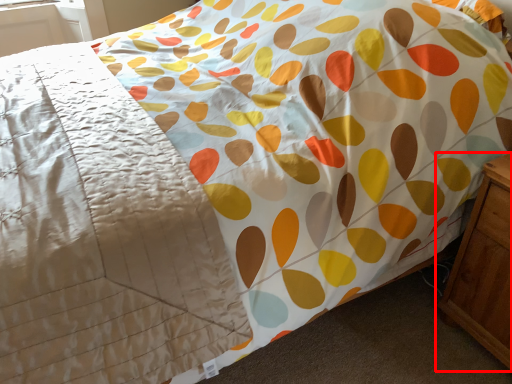
Question: From the image's perspective, considering the relative positions of nightstand (annotated by the red box) and blanket in the image provided, where is nightstand (annotated by the red box) located with respect to the staircase?

Choices:
 (A) above
 (B) below

Answer: (B)